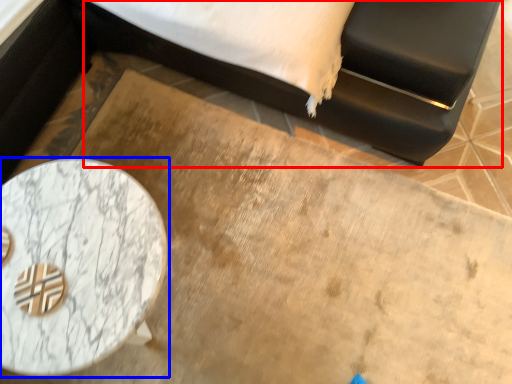
Question: Which object appears closest to the camera in this image, bed (highlighted by a red box) or table (highlighted by a blue box)?

Choices:
 (A) bed
 (B) table

Answer: (A)